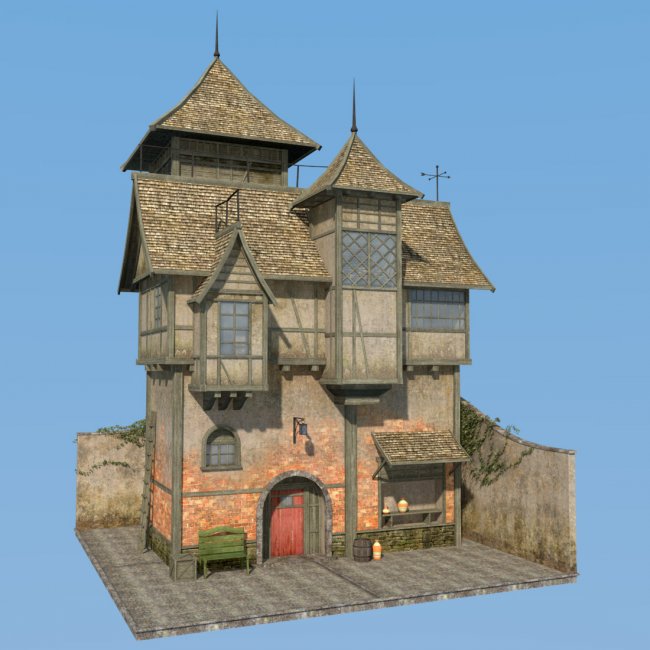
Identify the location of wall. (522, 510).